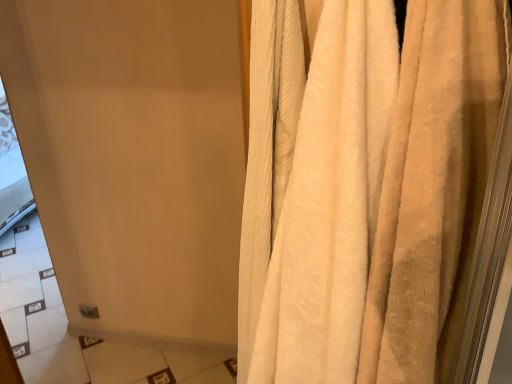
Question: Is matte white screen door at upper left to the left or to the right of beige textured curtain at right in the image?

Choices:
 (A) left
 (B) right

Answer: (A)

Question: From a real-world perspective, is matte white screen door at upper left positioned above or below beige textured curtain at right?

Choices:
 (A) above
 (B) below

Answer: (B)

Question: Considering the positions of matte white screen door at upper left and beige textured curtain at right in the image, is matte white screen door at upper left bigger or smaller than beige textured curtain at right?

Choices:
 (A) small
 (B) big

Answer: (B)

Question: Is beige textured curtain at right to the left or to the right of matte white screen door at upper left in the image?

Choices:
 (A) right
 (B) left

Answer: (A)

Question: From a real-world perspective, is beige textured curtain at right above or below matte white screen door at upper left?

Choices:
 (A) above
 (B) below

Answer: (A)

Question: Is beige textured curtain at right in front of or behind matte white screen door at upper left in the image?

Choices:
 (A) front
 (B) behind

Answer: (A)

Question: Is beige textured curtain at right taller or shorter than matte white screen door at upper left?

Choices:
 (A) short
 (B) tall

Answer: (A)